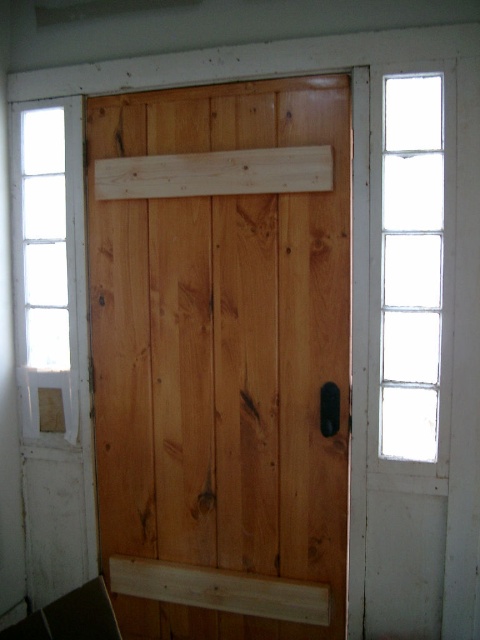
Question: Which object is farther from the camera taking this photo?

Choices:
 (A) natural wood barn door at center
 (B) clear glass window at right
 (C) clear glass window at left

Answer: (C)

Question: Can you confirm if natural wood barn door at center is positioned to the left of clear glass window at right?

Choices:
 (A) no
 (B) yes

Answer: (B)

Question: Does clear glass window at right have a larger size compared to clear glass window at left?

Choices:
 (A) no
 (B) yes

Answer: (B)

Question: Which object is closer to the camera taking this photo?

Choices:
 (A) natural wood barn door at center
 (B) clear glass window at right

Answer: (B)

Question: Which point is farther to the camera?

Choices:
 (A) (400, 177)
 (B) (50, 259)
 (C) (333, 125)

Answer: (B)

Question: Is natural wood barn door at center thinner than clear glass window at left?

Choices:
 (A) yes
 (B) no

Answer: (B)